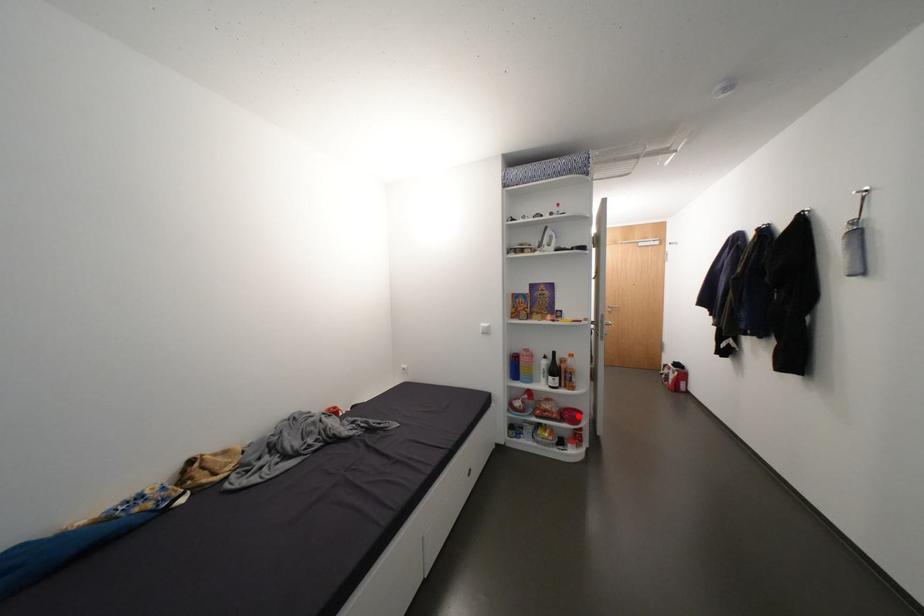
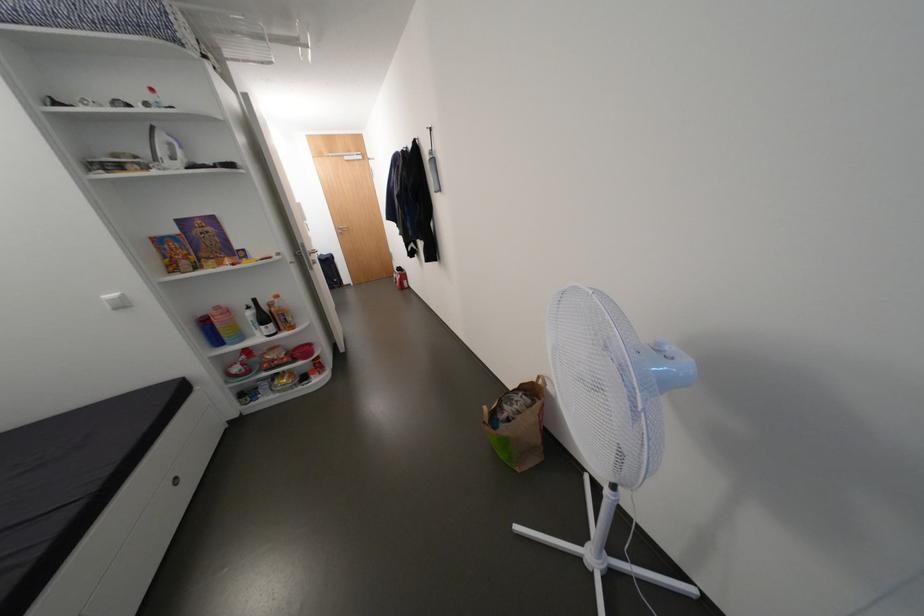
Question: I am providing you with two images of the same scene from different viewpoints. A red point is marked on the first image. Can you still see the location of the red point in image 2?

Choices:
 (A) Yes
 (B) No

Answer: (A)